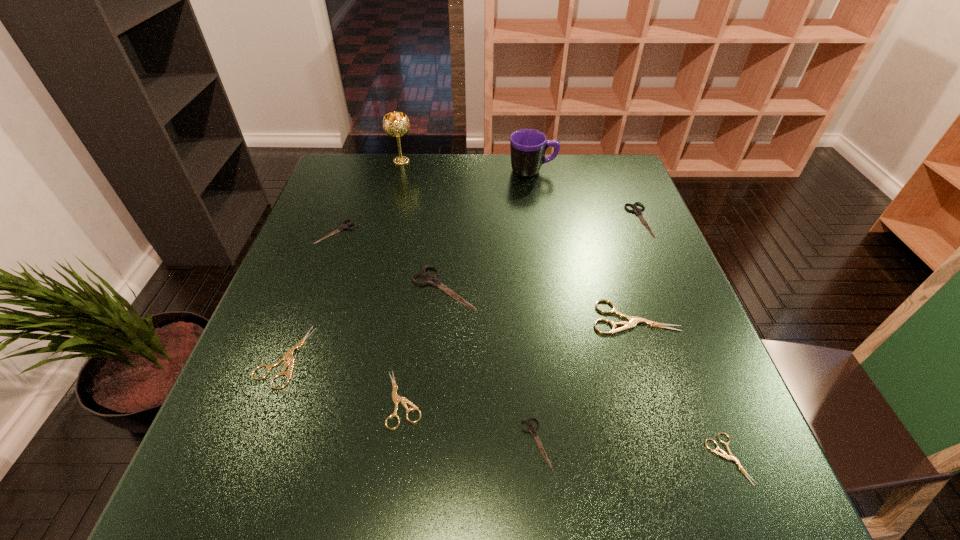
Identify which beige shears is located as the third nearest to the biggest beige shears. Please provide its 2D coordinates. Your answer should be formatted as a tuple, i.e. [(x, y)], where the tuple contains the x and y coordinates of a point satisfying the conditions above.

[(288, 356)]

Where is `vacant space that satisfies the following two spatial constraints: 1. with the handle on the side of the biggest beige shears; 2. on the right side of the mug`? vacant space that satisfies the following two spatial constraints: 1. with the handle on the side of the biggest beige shears; 2. on the right side of the mug is located at coordinates (556, 318).

Find the location of a particular element. vacant space that satisfies the following two spatial constraints: 1. on the front side of the leftmost black shears; 2. on the left side of the smallest beige shears is located at coordinates (254, 458).

This screenshot has height=540, width=960. I want to click on free space that satisfies the following two spatial constraints: 1. on the back side of the third biggest beige shears; 2. on the left side of the second biggest black shears, so click(x=428, y=220).

Image resolution: width=960 pixels, height=540 pixels. In order to click on vacant position in the image that satisfies the following two spatial constraints: 1. with the handle on the side of the black mug; 2. on the right side of the smallest beige shears in this screenshot , I will do `click(578, 458)`.

Locate an element on the screen. The width and height of the screenshot is (960, 540). free spot that satisfies the following two spatial constraints: 1. on the back side of the third biggest black shears; 2. on the right side of the second biggest black shears is located at coordinates (341, 220).